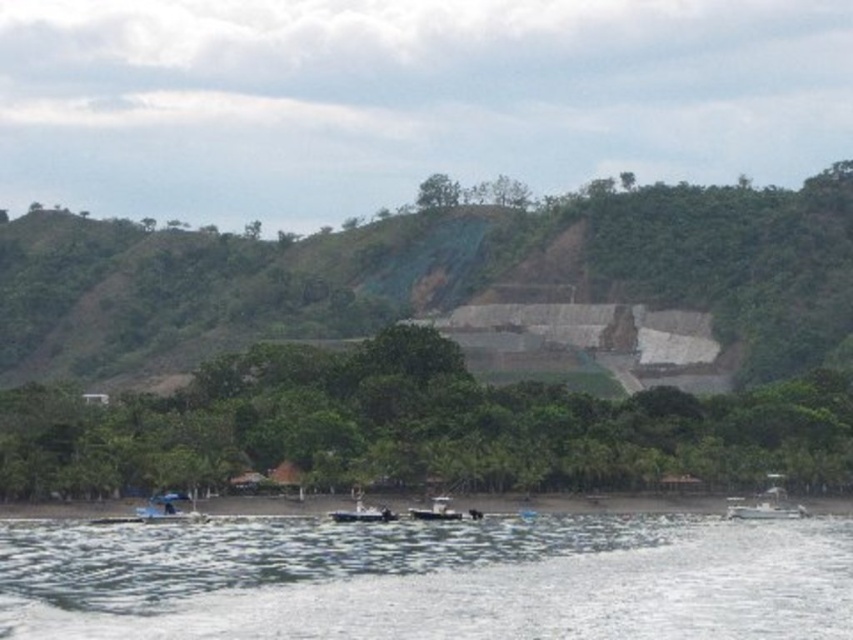
Question: Does white plastic boat at lower right appear on the right side of metallic gray boat at center?

Choices:
 (A) no
 (B) yes

Answer: (B)

Question: Which point is closer to the camera?

Choices:
 (A) (643, 595)
 (B) (337, 516)

Answer: (A)

Question: Which object is closer to the camera taking this photo?

Choices:
 (A) clear water at lower center
 (B) white plastic boat at lower right
 (C) metallic gray boat at center
 (D) white plastic boat at lower center

Answer: (A)

Question: Which is farther from the white plastic boat at lower center?

Choices:
 (A) metallic gray boat at center
 (B) clear water at lower center

Answer: (B)

Question: Considering the relative positions of green grassy hillside at center and clear water at lower center in the image provided, where is green grassy hillside at center located with respect to clear water at lower center?

Choices:
 (A) below
 (B) above

Answer: (B)

Question: Can you confirm if green grassy hillside at center is thinner than white plastic boat at lower center?

Choices:
 (A) no
 (B) yes

Answer: (A)